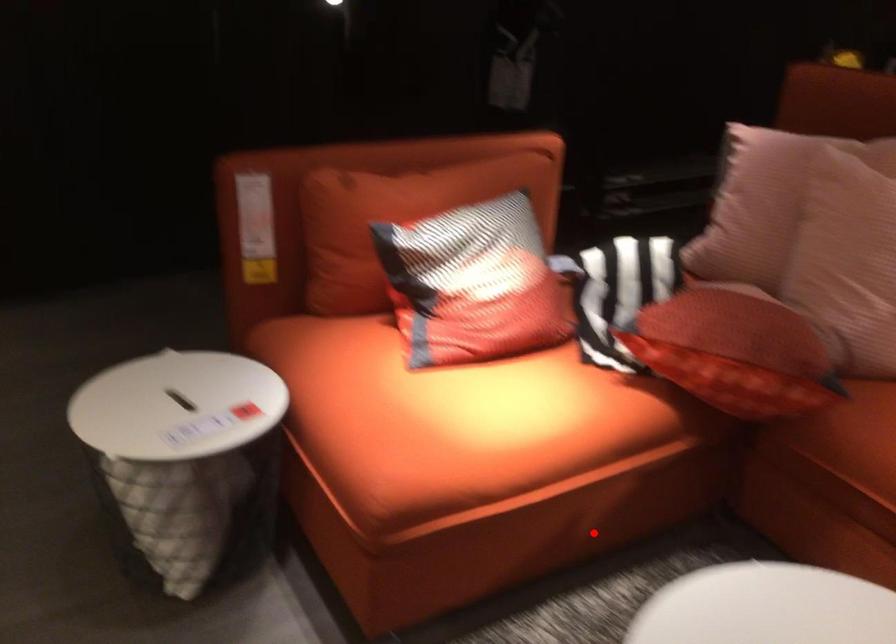
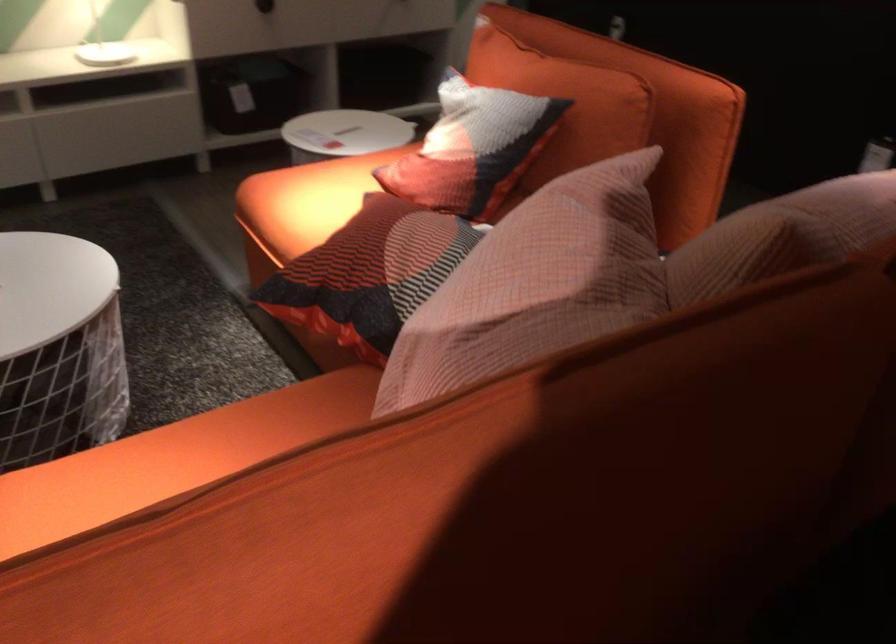
Question: A red point is marked in image1. In image2, is the corresponding 3D point closer to the camera or farther? Reply with the corresponding letter.

Choices:
 (A) The corresponding 3D point is closer.
 (B) The corresponding 3D point is farther.

Answer: (B)